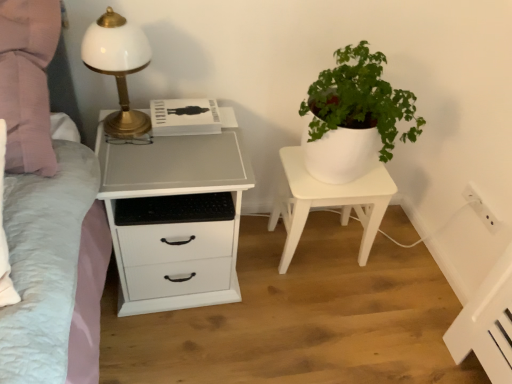
Where is `free location to the right of white matte chest of drawers at left`? This screenshot has width=512, height=384. free location to the right of white matte chest of drawers at left is located at coordinates (281, 296).